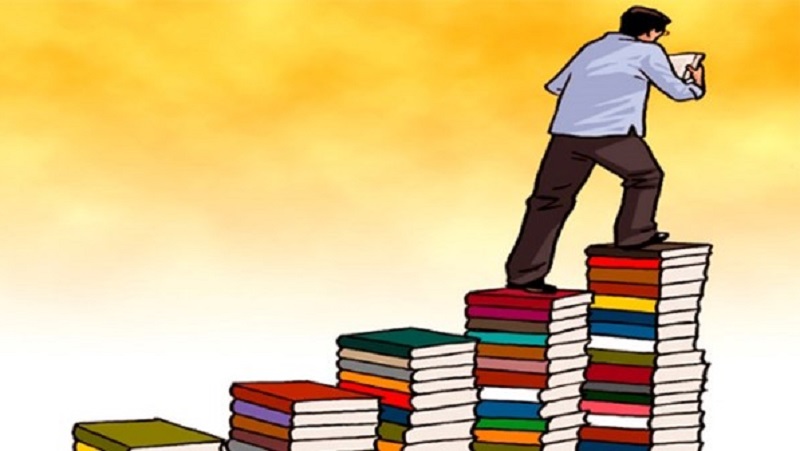
Find the location of a particular element. The width and height of the screenshot is (800, 451). blue books is located at coordinates (540, 344), (514, 409), (590, 447), (641, 335), (648, 322), (404, 417).